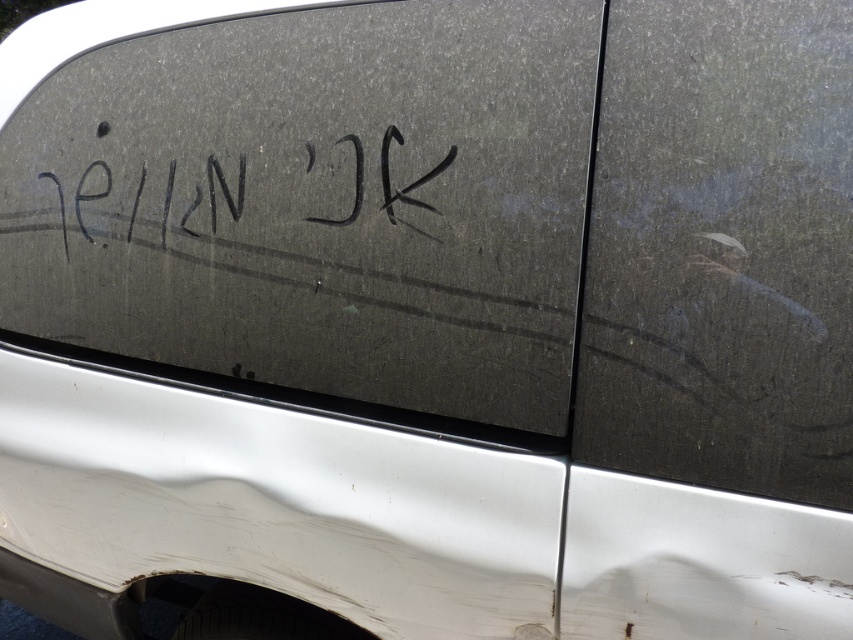
You are a delivery driver who needs to read the handwritten text on the vehicle door. The door has a matte black glass at center and black ink writing at center. Which object is smaller in size?

The matte black glass at center has a smaller size compared to the black ink writing at center, so the matte black glass at center is smaller.

You are a delivery person checking the vehicle for a delivery note. You see the matte black window at center and the black ink writing at center. Which object is taller?

The matte black window at center has a greater height compared to the black ink writing at center, so the matte black window at center is taller.